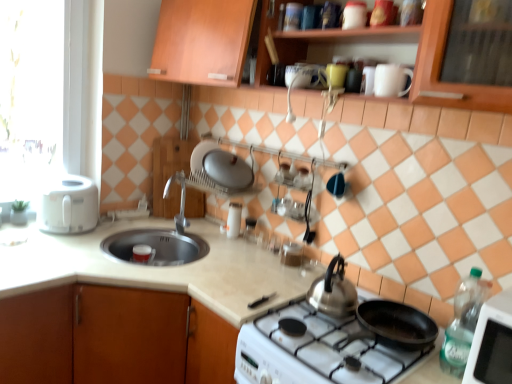
In order to face wooden cabinet at center, marked as the 2th cabinetry in a front-to-back arrangement, should I rotate leftwards or rightwards?

You should rotate left by 10.306 degrees.

At what (x,y) coordinates should I click in order to perform the action: click on green plastic bottle at lower right, the second kitchen appliance viewed from the left. Please return your answer as a coordinate pair (x, y). The height and width of the screenshot is (384, 512). Looking at the image, I should click on (463, 322).

Describe the element at coordinates (156, 268) in the screenshot. The height and width of the screenshot is (384, 512). I see `white matte countertop at lower left, the first countertop positioned from the right` at that location.

This screenshot has width=512, height=384. Describe the element at coordinates (180, 200) in the screenshot. I see `silver metallic faucet at center` at that location.

The width and height of the screenshot is (512, 384). In order to click on white matte mug at upper center, marked as the first mug in a front-to-back arrangement in this screenshot , I will do `click(391, 80)`.

Measure the distance between point (237,232) and camera.

Point (237,232) and camera are 2.21 meters apart.

The width and height of the screenshot is (512, 384). In order to click on white glossy soap dispenser at upper center, the 4th appliance positioned from the right in this screenshot , I will do `click(234, 220)`.

Find the location of a particular element. The width and height of the screenshot is (512, 384). wooden cabinet at center, marked as the 2th cabinetry in a front-to-back arrangement is located at coordinates (169, 172).

Which is more to the right, wooden cabinet at upper center, which appears as the 2th cabinetry when viewed from the back, or wooden cabinet at center, marked as the 2th cabinetry in a front-to-back arrangement?

Positioned to the right is wooden cabinet at upper center, which appears as the 2th cabinetry when viewed from the back.

You are a GUI agent. You are given a task and a screenshot of the screen. Output one action in this format:
    pyautogui.click(x=<x>, y=<y>)
    Task: Click on the cabinetry that appears behind the wooden cabinet at upper center, placed as the second cabinetry when sorted from bottom to top
    This screenshot has height=384, width=512.
    Given the screenshot: What is the action you would take?
    pyautogui.click(x=169, y=172)

Is wooden cabinet at upper center, the 1th cabinetry viewed from the top, located outside wooden cabinet at center, which appears as the 1th cabinetry when ordered from the bottom?

Yes, wooden cabinet at upper center, the 1th cabinetry viewed from the top, is not within wooden cabinet at center, which appears as the 1th cabinetry when ordered from the bottom.

Relative to glossy ceramic mug at upper center, the first mug from the top, is white glossy soap dispenser at upper center, the 1th appliance when ordered from left to right, in front or behind?

white glossy soap dispenser at upper center, the 1th appliance when ordered from left to right, is behind glossy ceramic mug at upper center, the first mug from the top.

Does white glossy soap dispenser at upper center, the 4th appliance positioned from the right, turn towards glossy ceramic mug at upper center, the 2th mug from the bottom?

No, white glossy soap dispenser at upper center, the 4th appliance positioned from the right, is not turned towards glossy ceramic mug at upper center, the 2th mug from the bottom.

Is white glossy soap dispenser at upper center, placed as the first appliance when sorted from back to front, bigger or smaller than glossy ceramic mug at upper center, the first mug from the top?

In the image, white glossy soap dispenser at upper center, placed as the first appliance when sorted from back to front, appears to be larger than glossy ceramic mug at upper center, the first mug from the top.

From a real-world perspective, is white glossy soap dispenser at upper center, the fourth appliance positioned from the front, located beneath glossy ceramic mug at upper center, which appears as the 1th mug when viewed from the back?

Yes.

Which is behind, point (27, 62) or point (290, 7)?

The point (27, 62) is more distant.

Is white plastic toaster at left taller than metallic silver canister at upper center, the third appliance viewed from the back?

Yes, white plastic toaster at left is taller than metallic silver canister at upper center, the third appliance viewed from the back.

How many degrees apart are the facing directions of white plastic toaster at left and wooden cabinet at upper center, the 1th cabinetry viewed from the top?

The facing directions of white plastic toaster at left and wooden cabinet at upper center, the 1th cabinetry viewed from the top, are 90 degrees apart.

Considering the sizes of objects white plastic toaster at left and wooden cabinet at upper center, the 1th cabinetry viewed from the top, in the image provided, who is taller, white plastic toaster at left or wooden cabinet at upper center, the 1th cabinetry viewed from the top,?

white plastic toaster at left.

From the image's perspective, would you say white plastic toaster at left is shown under wooden cabinet at upper center, placed as the second cabinetry when sorted from bottom to top?

Yes, from the image's perspective, white plastic toaster at left is beneath wooden cabinet at upper center, placed as the second cabinetry when sorted from bottom to top.

Is white plastic toaster at left oriented towards wooden cabinet at upper center, placed as the 1th cabinetry when sorted from front to back?

No, white plastic toaster at left is not facing towards wooden cabinet at upper center, placed as the 1th cabinetry when sorted from front to back.

Considering the relative positions of white glossy cup at upper center, arranged as the 3th appliance when ordered from the bottom, and white plastic toaster at left, the 1th kitchen appliance in the top-to-bottom sequence, in the image provided, is white glossy cup at upper center, arranged as the 3th appliance when ordered from the bottom, to the left or to the right of white plastic toaster at left, the 1th kitchen appliance in the top-to-bottom sequence,?

From the image, it's evident that white glossy cup at upper center, arranged as the 3th appliance when ordered from the bottom, is to the right of white plastic toaster at left, the 1th kitchen appliance in the top-to-bottom sequence.

Is the position of white glossy cup at upper center, which is the fourth appliance in back-to-front order, less distant than that of white plastic toaster at left, acting as the second kitchen appliance starting from the right?

Yes, white glossy cup at upper center, which is the fourth appliance in back-to-front order, is in front of white plastic toaster at left, acting as the second kitchen appliance starting from the right.

From the image's perspective, is white glossy cup at upper center, the 2th appliance positioned from the top, below white plastic toaster at left, the 1th kitchen appliance in the top-to-bottom sequence?

No, from the image's perspective, white glossy cup at upper center, the 2th appliance positioned from the top, is not beneath white plastic toaster at left, the 1th kitchen appliance in the top-to-bottom sequence.

Is point (349, 4) farther from viewer compared to point (52, 213)?

No, it is in front of (52, 213).

Is point (359, 9) more distant than point (406, 353)?

Yes, point (359, 9) is farther from viewer.

Is white glossy cup at upper center, arranged as the 3th appliance when ordered from the bottom, at the left side of white glossy gas stove at lower center?

In fact, white glossy cup at upper center, arranged as the 3th appliance when ordered from the bottom, is to the right of white glossy gas stove at lower center.

Is white glossy cup at upper center, the 2th appliance positioned from the top, looking in the opposite direction of white glossy gas stove at lower center?

That's not correct — white glossy cup at upper center, the 2th appliance positioned from the top, is not looking away from white glossy gas stove at lower center.

Is white glossy cup at upper center, which is the fourth appliance in back-to-front order, in front of or behind white glossy gas stove at lower center in the image?

Visually, white glossy cup at upper center, which is the fourth appliance in back-to-front order, is located behind white glossy gas stove at lower center.

Who is smaller, white matte mug at upper center, the first mug in the bottom-to-top sequence, or white plastic toaster at left, acting as the second kitchen appliance starting from the right?

Smaller between the two is white matte mug at upper center, the first mug in the bottom-to-top sequence.

Find the location of a particular element. kitchen appliance that appears behind the white matte mug at upper center, which appears as the second mug when viewed from the back is located at coordinates (68, 205).

Can white plastic toaster at left, the 2th kitchen appliance from the bottom, be found inside white matte mug at upper center, which appears as the second mug when viewed from the left?

No, white plastic toaster at left, the 2th kitchen appliance from the bottom, is not inside white matte mug at upper center, which appears as the second mug when viewed from the left.

The image size is (512, 384). In order to click on cabinetry that is in front of the wooden cabinet at center, which appears as the 1th cabinetry when ordered from the bottom in this screenshot , I will do `click(199, 39)`.

From the glossy ceramic mug at upper center, which appears as the 1th mug when viewed from the back, count 2nd appliances backward and point to it. Please provide its 2D coordinates.

[(234, 220)]

When comparing their distances from white glossy soap dispenser at upper center, the 4th appliance positioned from the right, does white glossy gas stove at lower center or metallic silver canister at upper center, the 2th appliance positioned from the front, seem further?

Among the two, metallic silver canister at upper center, the 2th appliance positioned from the front, is located further to white glossy soap dispenser at upper center, the 4th appliance positioned from the right.

From the image, which object appears to be nearer to white glossy gas stove at lower center, glossy ceramic mug at upper center, the 2th mug in the front-to-back sequence, or white matte mug at upper center, which appears as the second mug when viewed from the back?

white matte mug at upper center, which appears as the second mug when viewed from the back, is closer to white glossy gas stove at lower center.

When comparing their distances from green plastic bottle at lower right, positioned as the 2th kitchen appliance in top-to-bottom order, does wooden cabinet at upper center, placed as the 1th cabinetry when sorted from front to back, or silver metallic faucet at center seem closer?

Among the two, wooden cabinet at upper center, placed as the 1th cabinetry when sorted from front to back, is located nearer to green plastic bottle at lower right, positioned as the 2th kitchen appliance in top-to-bottom order.

Considering their positions, is white glossy gas stove at lower center positioned closer to white matte countertop at lower left, which is the second countertop in left-to-right order, than glossy ceramic mug at upper center, the 2th mug in the front-to-back sequence?

Among the two, white glossy gas stove at lower center is located nearer to white matte countertop at lower left, which is the second countertop in left-to-right order.

Estimate the real-world distances between objects in this image. Which object is further from silver metallic faucet at center, white plastic toaster at left, the 1th kitchen appliance in the top-to-bottom sequence, or white plastic toaster at left?

white plastic toaster at left is positioned further to the anchor silver metallic faucet at center.

From the image, which object appears to be nearer to white glossy cup at upper center, arranged as the first appliance when viewed from the right, green plastic bottle at lower right, positioned as the 2th kitchen appliance in top-to-bottom order, or beige laminate countertop at center, which is the second countertop from right to left?

green plastic bottle at lower right, positioned as the 2th kitchen appliance in top-to-bottom order, lies closer to white glossy cup at upper center, arranged as the first appliance when viewed from the right, than the other object.

From the image, which object appears to be nearer to wooden cabinet at upper center, which appears as the 2th cabinetry when viewed from the back, white glossy cup at upper center, the 1th appliance from the front, or metallic silver canister at upper center, marked as the first appliance in a top-to-bottom arrangement?

Among the two, metallic silver canister at upper center, marked as the first appliance in a top-to-bottom arrangement, is located nearer to wooden cabinet at upper center, which appears as the 2th cabinetry when viewed from the back.

Considering their positions, is wooden cabinet at center, marked as the 2th cabinetry in a front-to-back arrangement, positioned closer to metallic silver toaster at upper left, the 1th appliance positioned from the bottom, than white matte countertop at lower left, which is the second countertop in left-to-right order?

The object closer to metallic silver toaster at upper left, the 1th appliance positioned from the bottom, is wooden cabinet at center, marked as the 2th cabinetry in a front-to-back arrangement.

Image resolution: width=512 pixels, height=384 pixels. What are the coordinates of `cabinetry located between white plastic toaster at left and silver metallic faucet at center in the left-right direction` in the screenshot? It's located at (169, 172).

You are a GUI agent. You are given a task and a screenshot of the screen. Output one action in this format:
    pyautogui.click(x=<x>, y=<y>)
    Task: Click on the window screen between beige laminate countertop at center, which is the second countertop from right to left, and wooden cabinet at center, which is the second cabinetry in top-to-bottom order, in the front-back direction
    The image size is (512, 384).
    Given the screenshot: What is the action you would take?
    pyautogui.click(x=30, y=94)

Where is `countertop located between beige laminate countertop at center, which is the second countertop from right to left, and green plastic bottle at lower right, the first kitchen appliance in the bottom-to-top sequence, in the left-right direction`? countertop located between beige laminate countertop at center, which is the second countertop from right to left, and green plastic bottle at lower right, the first kitchen appliance in the bottom-to-top sequence, in the left-right direction is located at coordinates (156, 268).

Where is `faucet located between white plastic toaster at left, acting as the second kitchen appliance starting from the right, and white matte mug at upper center, placed as the 1th mug when sorted from right to left, in the left-right direction`? faucet located between white plastic toaster at left, acting as the second kitchen appliance starting from the right, and white matte mug at upper center, placed as the 1th mug when sorted from right to left, in the left-right direction is located at coordinates (180, 200).